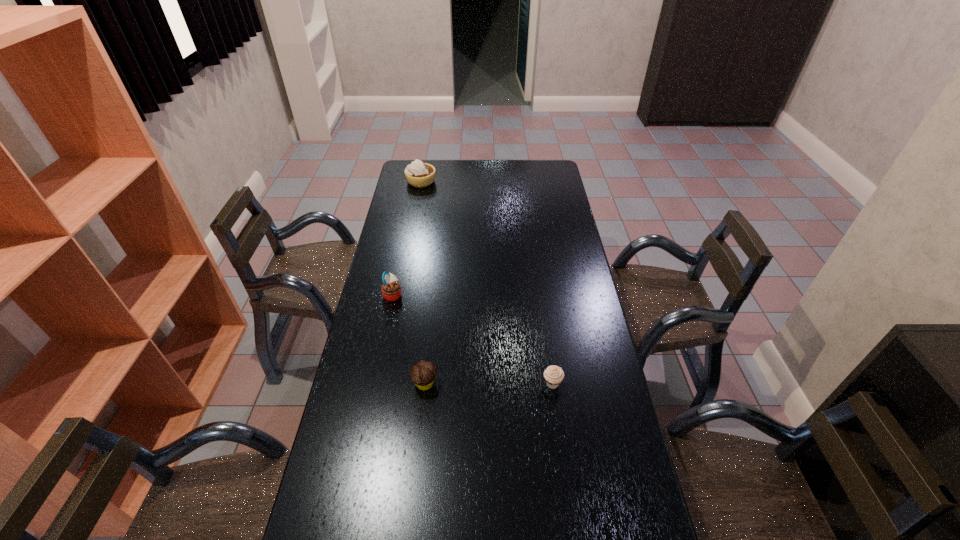
Locate an element on the screen. This screenshot has height=540, width=960. the third closest muffin to the farthest object is located at coordinates (554, 375).

The image size is (960, 540). What are the coordinates of `vacant region that satisfies the following two spatial constraints: 1. on the front-facing side of the rightmost object; 2. on the left side of the leftmost muffin` in the screenshot? It's located at (374, 384).

Identify the location of blank area in the image that satisfies the following two spatial constraints: 1. on the front-facing side of the rightmost muffin; 2. on the right side of the farthest muffin. (374, 384).

Locate an element on the screen. The height and width of the screenshot is (540, 960). free location that satisfies the following two spatial constraints: 1. on the front-facing side of the tallest muffin; 2. on the back side of the second muffin from right to left is located at coordinates (374, 383).